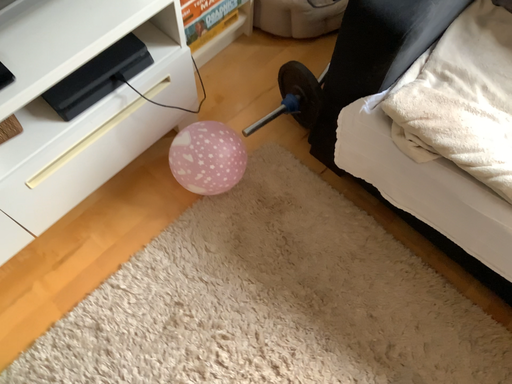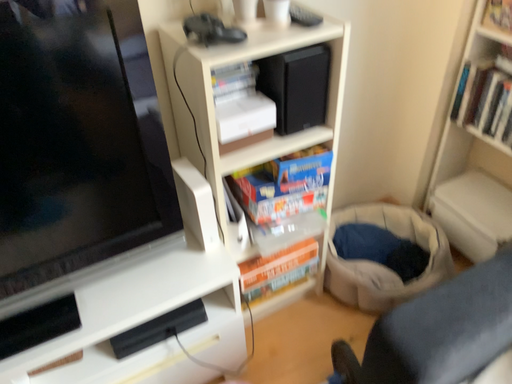
Question: How did the camera likely rotate when shooting the video?

Choices:
 (A) rotated right
 (B) rotated left

Answer: (B)